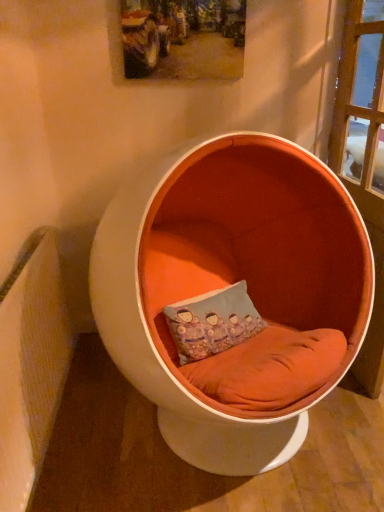
Question: Is orange fabric chair at center in front of or behind wooden textured picture frame at upper center in the image?

Choices:
 (A) behind
 (B) front

Answer: (B)

Question: Considering the positions of orange fabric chair at center and wooden textured picture frame at upper center in the image, is orange fabric chair at center taller or shorter than wooden textured picture frame at upper center?

Choices:
 (A) tall
 (B) short

Answer: (A)

Question: Considering the real-world distances, which object is farthest from the wooden textured picture frame at upper center?

Choices:
 (A) blue fabric pillow at center
 (B) orange fabric chair at center

Answer: (A)

Question: Which object is positioned farthest from the orange fabric chair at center?

Choices:
 (A) blue fabric pillow at center
 (B) wooden textured picture frame at upper center

Answer: (B)